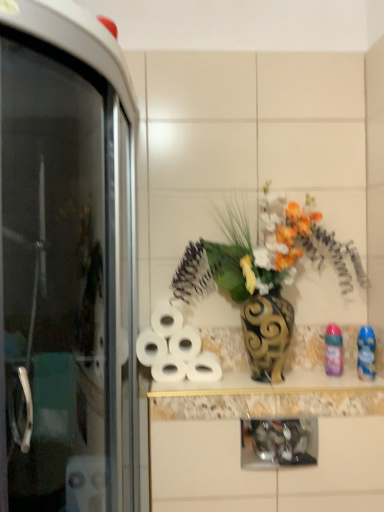
What do you see at coordinates (166, 319) in the screenshot? This screenshot has height=512, width=384. I see `white matte toilet paper at center, positioned as the fifth toilet paper in bottom-to-top order` at bounding box center [166, 319].

You are a GUI agent. You are given a task and a screenshot of the screen. Output one action in this format:
    pyautogui.click(x=<x>, y=<y>)
    Task: Click on the white matte toilet paper at center, which appears as the first toilet paper when viewed from the top
    The image size is (384, 512).
    Given the screenshot: What is the action you would take?
    pyautogui.click(x=166, y=319)

The width and height of the screenshot is (384, 512). What do you see at coordinates (168, 369) in the screenshot? I see `white matte toilet paper at center, the first toilet paper positioned from the bottom` at bounding box center [168, 369].

From the picture: Measure the distance between white matte toilet paper at center, which is counted as the 2th toilet paper, starting from the top, and camera.

white matte toilet paper at center, which is counted as the 2th toilet paper, starting from the top, and camera are 1.47 meters apart from each other.

Measure the distance between white matte toilet paper at center, positioned as the 3th toilet paper in bottom-to-top order, and camera.

white matte toilet paper at center, positioned as the 3th toilet paper in bottom-to-top order, is 1.44 meters away from camera.

Find the location of `white matte toilet paper at center, positioned as the 3th toilet paper in bottom-to-top order`. white matte toilet paper at center, positioned as the 3th toilet paper in bottom-to-top order is located at coordinates (150, 347).

In order to click on transparent glass screen door at left in this screenshot , I will do `click(66, 264)`.

Measure the distance between white matte toilet paper at center, the 2th toilet paper in the bottom-to-top sequence, and camera.

The distance of white matte toilet paper at center, the 2th toilet paper in the bottom-to-top sequence, from camera is 1.43 meters.

Image resolution: width=384 pixels, height=512 pixels. I want to click on white matte toilet paper at center, which appears as the first toilet paper when viewed from the top, so click(166, 319).

Measure the distance between white matte toilet paper at center, positioned as the fifth toilet paper in bottom-to-top order, and transparent glass screen door at left.

white matte toilet paper at center, positioned as the fifth toilet paper in bottom-to-top order, and transparent glass screen door at left are 19.05 inches apart from each other.

Considering the sizes of objects white matte toilet paper at center, which appears as the first toilet paper when viewed from the top, and transparent glass screen door at left in the image provided, who is thinner, white matte toilet paper at center, which appears as the first toilet paper when viewed from the top, or transparent glass screen door at left?

white matte toilet paper at center, which appears as the first toilet paper when viewed from the top.

Which is more to the left, white matte toilet paper at center, positioned as the fifth toilet paper in bottom-to-top order, or transparent glass screen door at left?

From the viewer's perspective, transparent glass screen door at left appears more on the left side.

Does white matte toilet paper at center, positioned as the fifth toilet paper in bottom-to-top order, come behind transparent glass screen door at left?

Yes, it is behind transparent glass screen door at left.

Does point (151, 336) come closer to viewer compared to point (161, 314)?

Yes, it is in front of point (161, 314).

Is white matte toilet paper at center, marked as the 3th toilet paper in a top-to-bottom arrangement, far away from white matte toilet paper at center, positioned as the fifth toilet paper in bottom-to-top order?

white matte toilet paper at center, marked as the 3th toilet paper in a top-to-bottom arrangement, is near white matte toilet paper at center, positioned as the fifth toilet paper in bottom-to-top order, not far away.

From a real-world perspective, is white matte toilet paper at center, marked as the 3th toilet paper in a top-to-bottom arrangement, beneath white matte toilet paper at center, positioned as the fifth toilet paper in bottom-to-top order?

Yes, from a real-world perspective, white matte toilet paper at center, marked as the 3th toilet paper in a top-to-bottom arrangement, is under white matte toilet paper at center, positioned as the fifth toilet paper in bottom-to-top order.

Is white matte toilet paper at center, the 4th toilet paper in the top-to-bottom sequence, at the right side of white matte toilet paper at center, marked as the 3th toilet paper in a top-to-bottom arrangement?

Indeed, white matte toilet paper at center, the 4th toilet paper in the top-to-bottom sequence, is positioned on the right side of white matte toilet paper at center, marked as the 3th toilet paper in a top-to-bottom arrangement.

Which is in front, point (210, 371) or point (157, 346)?

Positioned in front is point (157, 346).

Is white matte toilet paper at center, the 2th toilet paper in the bottom-to-top sequence, facing away from white matte toilet paper at center, positioned as the 3th toilet paper in bottom-to-top order?

white matte toilet paper at center, the 2th toilet paper in the bottom-to-top sequence, is not turned away from white matte toilet paper at center, positioned as the 3th toilet paper in bottom-to-top order.

From the picture: Is white matte toilet paper at center, positioned as the fifth toilet paper in bottom-to-top order, wider than white matte toilet paper at center, positioned as the 3th toilet paper in bottom-to-top order?

In fact, white matte toilet paper at center, positioned as the fifth toilet paper in bottom-to-top order, might be narrower than white matte toilet paper at center, positioned as the 3th toilet paper in bottom-to-top order.

Considering the relative sizes of white matte toilet paper at center, positioned as the fifth toilet paper in bottom-to-top order, and white matte toilet paper at center, marked as the 3th toilet paper in a top-to-bottom arrangement, in the image provided, is white matte toilet paper at center, positioned as the fifth toilet paper in bottom-to-top order, bigger than white matte toilet paper at center, marked as the 3th toilet paper in a top-to-bottom arrangement,?

Yes, white matte toilet paper at center, positioned as the fifth toilet paper in bottom-to-top order, is bigger than white matte toilet paper at center, marked as the 3th toilet paper in a top-to-bottom arrangement.

Is white matte toilet paper at center, positioned as the fifth toilet paper in bottom-to-top order, inside the boundaries of white matte toilet paper at center, positioned as the 3th toilet paper in bottom-to-top order, or outside?

white matte toilet paper at center, positioned as the fifth toilet paper in bottom-to-top order, is not enclosed by white matte toilet paper at center, positioned as the 3th toilet paper in bottom-to-top order.

From a real-world perspective, who is located lower, white matte toilet paper at center, positioned as the fifth toilet paper in bottom-to-top order, or white matte toilet paper at center, positioned as the 3th toilet paper in bottom-to-top order?

white matte toilet paper at center, positioned as the 3th toilet paper in bottom-to-top order, from a real-world perspective.

Considering the relative sizes of white matte toilet paper at center, the first toilet paper positioned from the bottom, and white matte toilet paper at center, marked as the 3th toilet paper in a top-to-bottom arrangement, in the image provided, is white matte toilet paper at center, the first toilet paper positioned from the bottom, wider than white matte toilet paper at center, marked as the 3th toilet paper in a top-to-bottom arrangement,?

In fact, white matte toilet paper at center, the first toilet paper positioned from the bottom, might be narrower than white matte toilet paper at center, marked as the 3th toilet paper in a top-to-bottom arrangement.

Consider the image. Visually, is white matte toilet paper at center, placed as the fifth toilet paper when sorted from top to bottom, positioned to the left or to the right of white matte toilet paper at center, positioned as the 3th toilet paper in bottom-to-top order?

Clearly, white matte toilet paper at center, placed as the fifth toilet paper when sorted from top to bottom, is on the right of white matte toilet paper at center, positioned as the 3th toilet paper in bottom-to-top order, in the image.

Where is `the 1st toilet paper behind the white matte toilet paper at center, positioned as the 3th toilet paper in bottom-to-top order`? This screenshot has width=384, height=512. the 1st toilet paper behind the white matte toilet paper at center, positioned as the 3th toilet paper in bottom-to-top order is located at coordinates (168, 369).

Does white matte toilet paper at center, placed as the fifth toilet paper when sorted from top to bottom, come in front of white matte toilet paper at center, positioned as the 3th toilet paper in bottom-to-top order?

No, white matte toilet paper at center, placed as the fifth toilet paper when sorted from top to bottom, is further to the viewer.

Could you measure the distance between white matte toilet paper at center, which is counted as the 2th toilet paper, starting from the top, and white matte toilet paper at center, the first toilet paper positioned from the bottom?

The distance of white matte toilet paper at center, which is counted as the 2th toilet paper, starting from the top, from white matte toilet paper at center, the first toilet paper positioned from the bottom, is 2.57 inches.

Between white matte toilet paper at center, which is counted as the 2th toilet paper, starting from the top, and white matte toilet paper at center, the first toilet paper positioned from the bottom, which one has more height?

white matte toilet paper at center, which is counted as the 2th toilet paper, starting from the top.

Is white matte toilet paper at center, arranged as the 4th toilet paper when ordered from the bottom, not inside white matte toilet paper at center, the first toilet paper positioned from the bottom?

Yes, white matte toilet paper at center, arranged as the 4th toilet paper when ordered from the bottom, is not within white matte toilet paper at center, the first toilet paper positioned from the bottom.

Can you confirm if white matte toilet paper at center, which appears as the first toilet paper when viewed from the top, is shorter than white matte toilet paper at center, the first toilet paper positioned from the bottom?

No, white matte toilet paper at center, which appears as the first toilet paper when viewed from the top, is not shorter than white matte toilet paper at center, the first toilet paper positioned from the bottom.

Starting from the white matte toilet paper at center, placed as the fifth toilet paper when sorted from top to bottom, which toilet paper is the 3rd one behind? Please provide its 2D coordinates.

[(166, 319)]

Between white matte toilet paper at center, positioned as the fifth toilet paper in bottom-to-top order, and white matte toilet paper at center, the first toilet paper positioned from the bottom, which one has smaller width?

Thinner between the two is white matte toilet paper at center, positioned as the fifth toilet paper in bottom-to-top order.

Which toilet paper is the 2nd one when counting from the right side of the transparent glass screen door at left? Please provide its 2D coordinates.

[(166, 319)]

From the image's perspective, starting from the white matte toilet paper at center, positioned as the 3th toilet paper in bottom-to-top order, which toilet paper is the 2nd one above? Please provide its 2D coordinates.

[(166, 319)]

Based on their spatial positions, is metallic gold vase at center or white matte toilet paper at center, positioned as the fifth toilet paper in bottom-to-top order, further from white matte toilet paper at center, the 4th toilet paper in the top-to-bottom sequence?

metallic gold vase at center lies further to white matte toilet paper at center, the 4th toilet paper in the top-to-bottom sequence, than the other object.

From the image, which object appears to be nearer to white matte toilet paper at center, the first toilet paper positioned from the bottom, white matte toilet paper at center, arranged as the 4th toilet paper when ordered from the bottom, or white matte toilet paper at center, which appears as the first toilet paper when viewed from the top?

white matte toilet paper at center, arranged as the 4th toilet paper when ordered from the bottom, lies closer to white matte toilet paper at center, the first toilet paper positioned from the bottom, than the other object.

From the image, which object appears to be nearer to transparent glass screen door at left, metallic gold vase at center or white matte toilet paper at center, which is counted as the 2th toilet paper, starting from the top?

metallic gold vase at center is positioned closer to the anchor transparent glass screen door at left.

Looking at the image, which one is located closer to white matte toilet paper at center, arranged as the 4th toilet paper when ordered from the bottom, metallic gold vase at center or white matte toilet paper at center, placed as the fifth toilet paper when sorted from top to bottom?

white matte toilet paper at center, placed as the fifth toilet paper when sorted from top to bottom, is closer to white matte toilet paper at center, arranged as the 4th toilet paper when ordered from the bottom.

When comparing their distances from white matte toilet paper at center, which is counted as the 2th toilet paper, starting from the top, does metallic gold vase at center or white matte toilet paper at center, which appears as the first toilet paper when viewed from the top, seem closer?

Based on the image, white matte toilet paper at center, which appears as the first toilet paper when viewed from the top, appears to be nearer to white matte toilet paper at center, which is counted as the 2th toilet paper, starting from the top.

When comparing their distances from transparent glass screen door at left, does white matte toilet paper at center, which appears as the first toilet paper when viewed from the top, or white matte toilet paper at center, the first toilet paper positioned from the bottom, seem further?

Based on the image, white matte toilet paper at center, the first toilet paper positioned from the bottom, appears to be further to transparent glass screen door at left.

Based on their spatial positions, is white matte toilet paper at center, the 2th toilet paper in the bottom-to-top sequence, or metallic gold vase at center closer to white matte toilet paper at center, positioned as the 3th toilet paper in bottom-to-top order?

white matte toilet paper at center, the 2th toilet paper in the bottom-to-top sequence.

Looking at the image, which one is located closer to white matte toilet paper at center, the 4th toilet paper in the top-to-bottom sequence, white matte toilet paper at center, arranged as the 4th toilet paper when ordered from the bottom, or transparent glass screen door at left?

white matte toilet paper at center, arranged as the 4th toilet paper when ordered from the bottom, lies closer to white matte toilet paper at center, the 4th toilet paper in the top-to-bottom sequence, than the other object.

Find the location of a particular element. floral arrangement located between transparent glass screen door at left and white matte toilet paper at center, the first toilet paper positioned from the bottom, in the depth direction is located at coordinates (263, 272).

Where is `floral arrangement between transparent glass screen door at left and white matte toilet paper at center, which is counted as the 2th toilet paper, starting from the top, from front to back`? This screenshot has width=384, height=512. floral arrangement between transparent glass screen door at left and white matte toilet paper at center, which is counted as the 2th toilet paper, starting from the top, from front to back is located at coordinates (263, 272).

This screenshot has height=512, width=384. In order to click on floral arrangement positioned between transparent glass screen door at left and white matte toilet paper at center, positioned as the fifth toilet paper in bottom-to-top order, from near to far in this screenshot , I will do `click(263, 272)`.

Where is `floral arrangement between transparent glass screen door at left and white matte toilet paper at center, the 4th toilet paper in the top-to-bottom sequence, from front to back`? This screenshot has height=512, width=384. floral arrangement between transparent glass screen door at left and white matte toilet paper at center, the 4th toilet paper in the top-to-bottom sequence, from front to back is located at coordinates (263, 272).